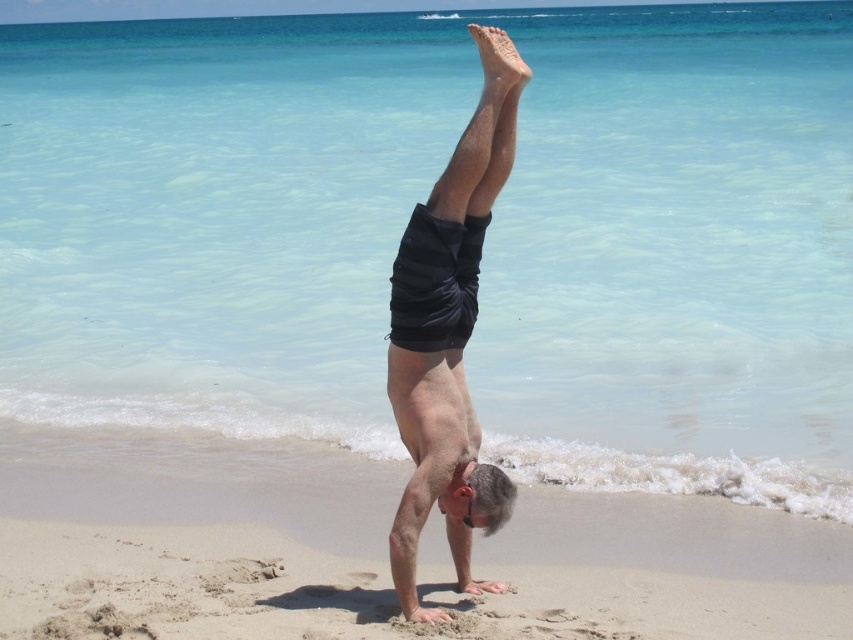
Question: Among these objects, which one is nearest to the camera?

Choices:
 (A) beige sandy beach at center
 (B) black striped shorts at center

Answer: (B)

Question: Is beige sandy beach at center positioned behind black striped shorts at center?

Choices:
 (A) no
 (B) yes

Answer: (B)

Question: Does beige sandy beach at center have a smaller size compared to black striped shorts at center?

Choices:
 (A) no
 (B) yes

Answer: (A)

Question: Which of the following is the closest to the observer?

Choices:
 (A) (305, 541)
 (B) (413, 413)

Answer: (B)

Question: Can you confirm if beige sandy beach at center is positioned below black striped shorts at center?

Choices:
 (A) no
 (B) yes

Answer: (B)